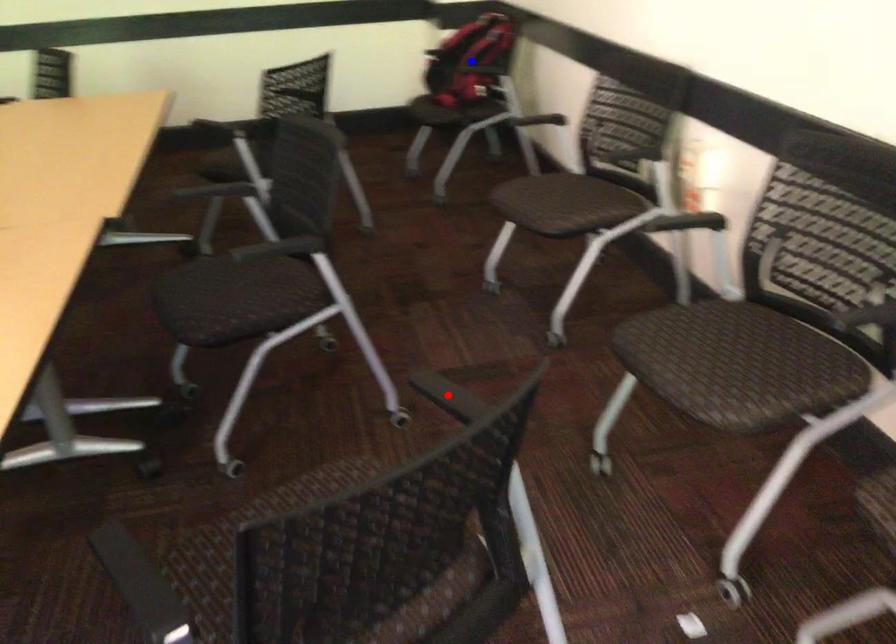
Question: In the image, two points are highlighted. Which point is nearer to the camera? Reply with the corresponding letter.

Choices:
 (A) blue point
 (B) red point

Answer: (B)